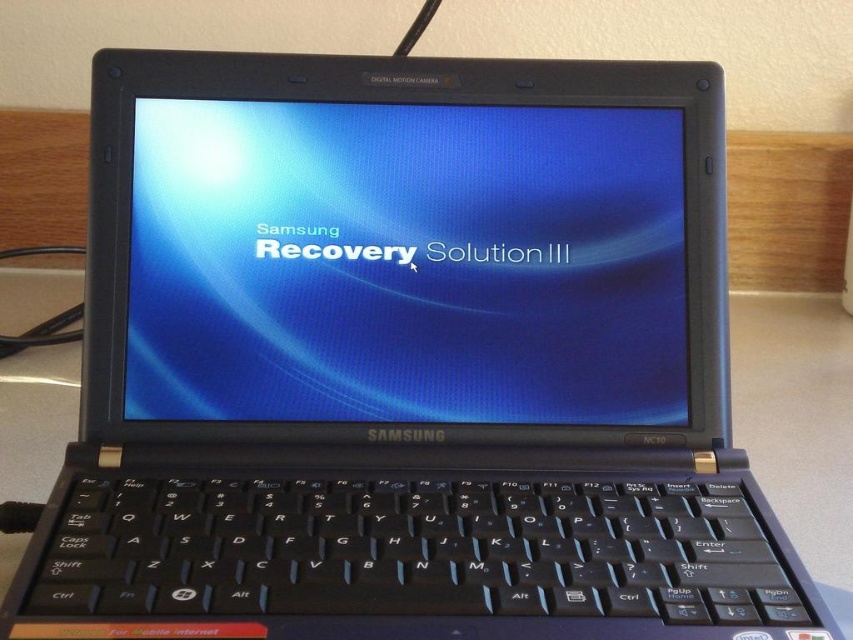
Can you confirm if blue glossy screen at center is bigger than black plastic keyboard at center?

Yes.

Does blue glossy screen at center have a greater width compared to black plastic keyboard at center?

In fact, blue glossy screen at center might be narrower than black plastic keyboard at center.

Locate an element on the screen. This screenshot has height=640, width=853. blue glossy screen at center is located at coordinates click(x=405, y=262).